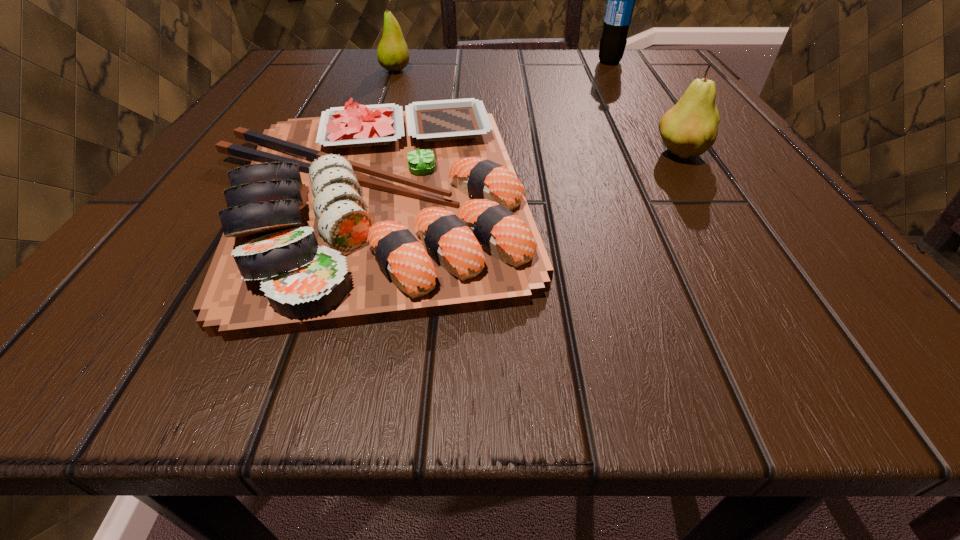
Where is `object that is at the near edge`? This screenshot has width=960, height=540. object that is at the near edge is located at coordinates (368, 214).

Identify the location of object present at the left edge. The width and height of the screenshot is (960, 540). (368, 214).

Where is `soda bottle situated at the right edge`? soda bottle situated at the right edge is located at coordinates (620, 0).

Identify the location of pear that is at the right edge. This screenshot has height=540, width=960. (690, 127).

The height and width of the screenshot is (540, 960). Find the location of `object present at the near left corner`. object present at the near left corner is located at coordinates (368, 214).

This screenshot has height=540, width=960. Identify the location of object located at the far right corner. (620, 0).

The height and width of the screenshot is (540, 960). I want to click on free space at the far edge, so click(365, 93).

At what (x,y) coordinates should I click in order to perform the action: click on vacant space at the near edge of the desktop. Please return your answer as a coordinate pair (x, y). The width and height of the screenshot is (960, 540). Looking at the image, I should click on (601, 351).

The width and height of the screenshot is (960, 540). I want to click on vacant region at the right edge, so (718, 157).

The width and height of the screenshot is (960, 540). In the image, there is a desktop. In order to click on vacant space at the near left corner in this screenshot , I will do `click(88, 359)`.